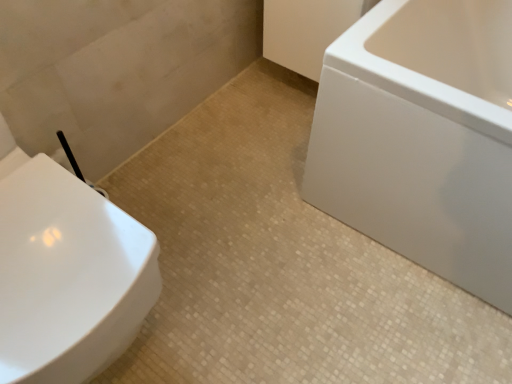
Question: Is white glossy toilet at left taller or shorter than beige mosaic tile at center?

Choices:
 (A) short
 (B) tall

Answer: (B)

Question: From the image's perspective, is white glossy toilet at left located above or below beige mosaic tile at center?

Choices:
 (A) above
 (B) below

Answer: (A)

Question: Which object is the closest to the beige mosaic tile at center?

Choices:
 (A) white glossy toilet at left
 (B) white glossy bathtub at right

Answer: (B)

Question: Which object is the closest to the beige mosaic tile at center?

Choices:
 (A) white glossy bathtub at right
 (B) white glossy toilet at left

Answer: (A)